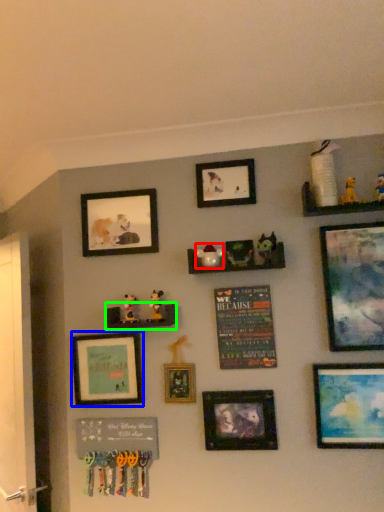
Question: Estimate the real-world distances between objects in this image. Which object is closer to toy (highlighted by a red box), picture frame (highlighted by a blue box) or shelf (highlighted by a green box)?

Choices:
 (A) picture frame
 (B) shelf

Answer: (B)